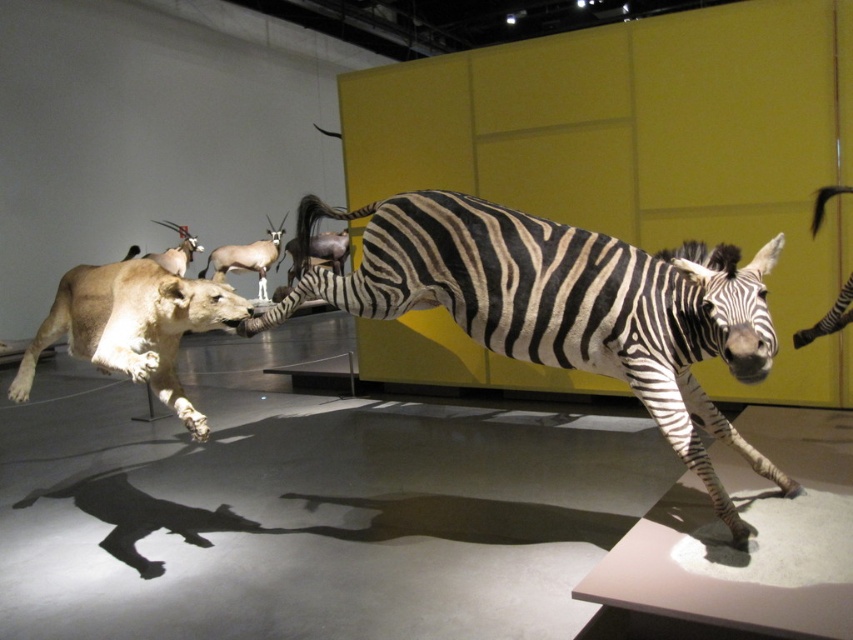
You are a museum curator planning to move the light brown fur lioness at left and the brown glossy antelope at upper left to a new display. If the new display has a shelf that can only accommodate the wider of the two, which animal should be placed there?

The light brown fur lioness at left is wider than the brown glossy antelope at upper left, so the lioness should be placed on the shelf.

You are a museum visitor who wants to take a photo of the light brown fur lioness at left and the brown glossy antelope at upper left. Which animal should you focus on first if you want to capture both in the same frame without zooming in or out?

The light brown fur lioness at left is much taller than the brown glossy antelope at upper left, so you should focus on the light brown fur lioness at left first to ensure it fits in the frame.

From the picture: You are a museum visitor trying to take a photo of the light brown fur lioness at left and the brown glossy antelope at center. If you want to capture both in the frame without moving your camera, which animal should you focus on to ensure both are visible?

The light brown fur lioness at left is larger in width than the brown glossy antelope at center. To ensure both are visible in the frame, focus on the larger light brown fur lioness at left since it occupies more space and the smaller antelope can be included alongside it.